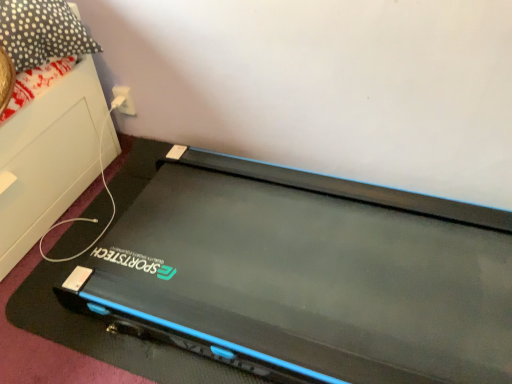
Question: Is polka dot fabric pillow at upper left positioned behind black matte treadmill at center?

Choices:
 (A) yes
 (B) no

Answer: (A)

Question: Does polka dot fabric pillow at upper left have a lesser width compared to black matte treadmill at center?

Choices:
 (A) no
 (B) yes

Answer: (B)

Question: Does polka dot fabric pillow at upper left contain black matte treadmill at center?

Choices:
 (A) no
 (B) yes

Answer: (A)

Question: Considering the relative sizes of polka dot fabric pillow at upper left and black matte treadmill at center in the image provided, is polka dot fabric pillow at upper left shorter than black matte treadmill at center?

Choices:
 (A) no
 (B) yes

Answer: (B)

Question: Considering the relative positions of polka dot fabric pillow at upper left and black matte treadmill at center in the image provided, is polka dot fabric pillow at upper left to the left of black matte treadmill at center from the viewer's perspective?

Choices:
 (A) no
 (B) yes

Answer: (B)

Question: Would you say polka dot fabric pillow at upper left is outside black matte treadmill at center?

Choices:
 (A) no
 (B) yes

Answer: (B)

Question: From the image's perspective, would you say black matte treadmill at center is positioned over polka dot fabric pillow at upper left?

Choices:
 (A) no
 (B) yes

Answer: (A)

Question: Is black matte treadmill at center shorter than polka dot fabric pillow at upper left?

Choices:
 (A) yes
 (B) no

Answer: (B)

Question: Considering the relative sizes of black matte treadmill at center and polka dot fabric pillow at upper left in the image provided, is black matte treadmill at center thinner than polka dot fabric pillow at upper left?

Choices:
 (A) yes
 (B) no

Answer: (B)

Question: Does black matte treadmill at center come in front of polka dot fabric pillow at upper left?

Choices:
 (A) yes
 (B) no

Answer: (A)

Question: Is black matte treadmill at center taller than polka dot fabric pillow at upper left?

Choices:
 (A) yes
 (B) no

Answer: (A)

Question: Is polka dot fabric pillow at upper left inside black matte treadmill at center?

Choices:
 (A) no
 (B) yes

Answer: (A)

Question: Does polka dot fabric pillow at upper left have a lesser width compared to white plastic at upper center?

Choices:
 (A) yes
 (B) no

Answer: (B)